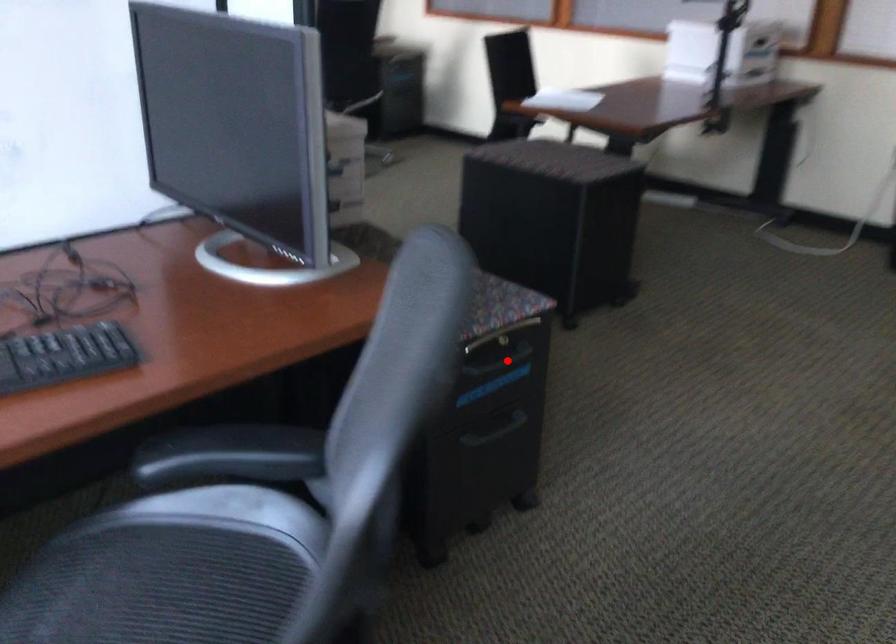
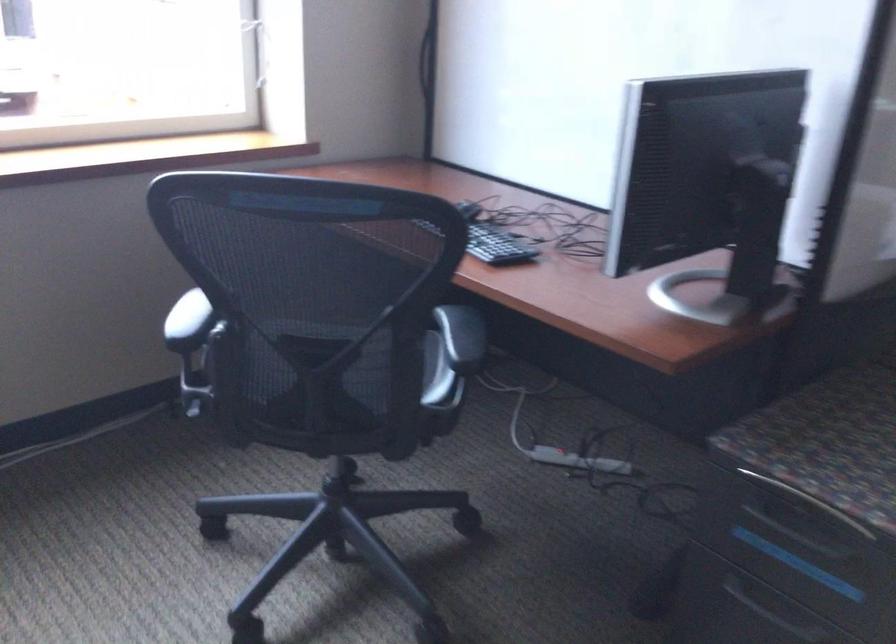
Find the pixel in the second image that matches the highlighted location in the first image.

(800, 536)